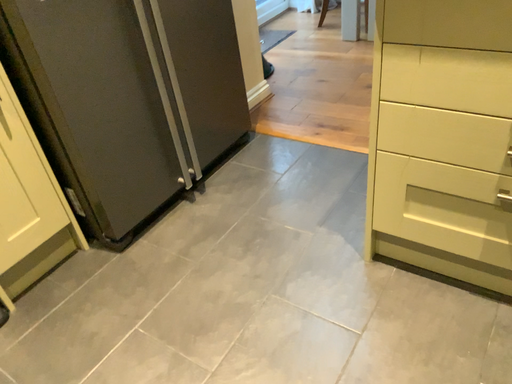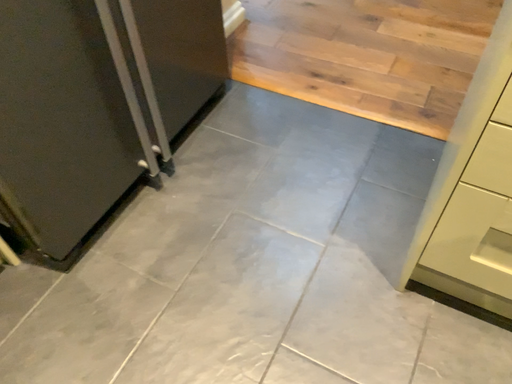
Question: How did the camera likely rotate when shooting the video?

Choices:
 (A) rotated left
 (B) rotated right

Answer: (B)